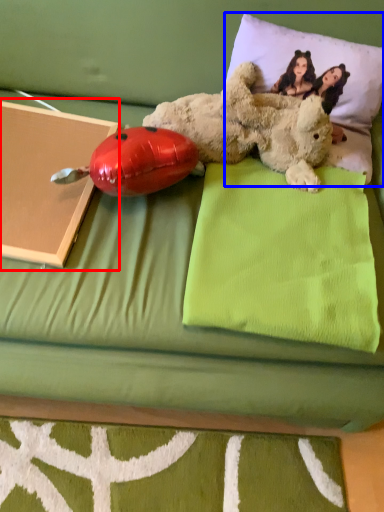
Question: Among these objects, which one is farthest to the camera, paperback book (highlighted by a red box) or pillow (highlighted by a blue box)?

Choices:
 (A) paperback book
 (B) pillow

Answer: (B)